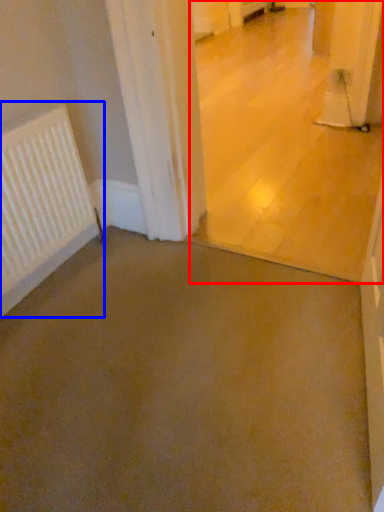
Question: Among these objects, which one is nearest to the camera, concrete (highlighted by a red box) or radiator (highlighted by a blue box)?

Choices:
 (A) concrete
 (B) radiator

Answer: (A)